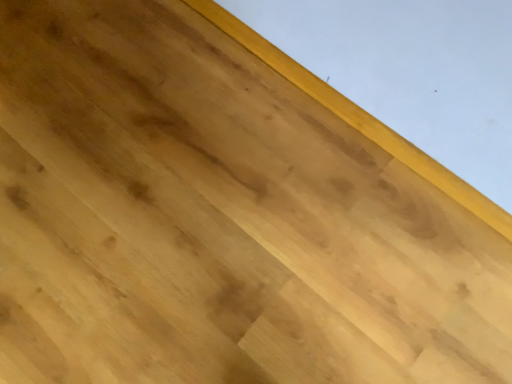
Find the location of a particular element. The image size is (512, 384). natural wood plank at upper right is located at coordinates (357, 117).

Measure the distance between point (x=312, y=80) and camera.

Point (x=312, y=80) is 1.02 meters from camera.

What do you see at coordinates (357, 117) in the screenshot? I see `natural wood plank at upper right` at bounding box center [357, 117].

This screenshot has width=512, height=384. I want to click on natural wood plank at upper right, so point(357,117).